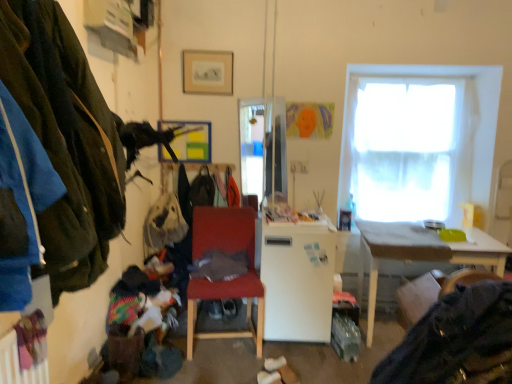
This screenshot has height=384, width=512. Describe the element at coordinates (432, 291) in the screenshot. I see `velvet-like brown swivel chair at lower right` at that location.

I want to click on transparent plastic door at center, so click(x=263, y=147).

In order to click on white sheer curtain at upper right in this screenshot , I will do `click(417, 141)`.

Is matte gold picture frame at upper center, the 1th picture frame from the top, facing towards matte red chair at center?

No, matte gold picture frame at upper center, the 1th picture frame from the top, is not aimed at matte red chair at center.

How many degrees apart are the facing directions of matte gold picture frame at upper center, which ranks as the first picture frame in front-to-back order, and matte red chair at center?

11.1 degrees separate the facing orientations of matte gold picture frame at upper center, which ranks as the first picture frame in front-to-back order, and matte red chair at center.

Is there a large distance between matte gold picture frame at upper center, which ranks as the first picture frame in front-to-back order, and matte red chair at center?

matte gold picture frame at upper center, which ranks as the first picture frame in front-to-back order, is positioned a significant distance from matte red chair at center.

Considering the sizes of velvet green jacket at left, arranged as the 1th clothing when viewed from the top, and matte red chair at center in the image, is velvet green jacket at left, arranged as the 1th clothing when viewed from the top, wider or thinner than matte red chair at center?

In the image, velvet green jacket at left, arranged as the 1th clothing when viewed from the top, appears to be more narrow than matte red chair at center.

In the scene shown: Can we say velvet green jacket at left, arranged as the 1th clothing when viewed from the top, lies outside matte red chair at center?

Yes, velvet green jacket at left, arranged as the 1th clothing when viewed from the top, is located beyond the bounds of matte red chair at center.

In the scene shown: Is velvet green jacket at left, arranged as the 1th clothing when viewed from the top, looking in the opposite direction of matte red chair at center?

No, velvet green jacket at left, arranged as the 1th clothing when viewed from the top, is not facing away from matte red chair at center.

From a real-world perspective, is velvet green jacket at left, arranged as the 1th clothing when viewed from the top, physically located above or below matte red chair at center?

In terms of real-world spatial position, velvet green jacket at left, arranged as the 1th clothing when viewed from the top, is above matte red chair at center.

Does metallic silver picture frame at upper center, the first picture frame positioned from the bottom, appear on the right side of matte gold picture frame at upper center, which ranks as the first picture frame in front-to-back order?

No, metallic silver picture frame at upper center, the first picture frame positioned from the bottom, is not to the right of matte gold picture frame at upper center, which ranks as the first picture frame in front-to-back order.

Could matte gold picture frame at upper center, which ranks as the first picture frame in front-to-back order, be considered to be inside metallic silver picture frame at upper center, the first picture frame positioned from the bottom?

That's incorrect, matte gold picture frame at upper center, which ranks as the first picture frame in front-to-back order, is not inside metallic silver picture frame at upper center, the first picture frame positioned from the bottom.

Which of these two, metallic silver picture frame at upper center, acting as the first picture frame starting from the back, or matte gold picture frame at upper center, the 2th picture frame positioned from the back, is smaller?

With smaller size is matte gold picture frame at upper center, the 2th picture frame positioned from the back.

From a real-world perspective, is metallic silver picture frame at upper center, positioned as the second picture frame in front-to-back order, over matte gold picture frame at upper center, the 1th picture frame from the top?

No, from a real-world perspective, metallic silver picture frame at upper center, positioned as the second picture frame in front-to-back order, is not on top of matte gold picture frame at upper center, the 1th picture frame from the top.

From the image's perspective, does velvet-like brown swivel chair at lower right appear lower than white matte refrigerator at center?

Incorrect, from the image's perspective, velvet-like brown swivel chair at lower right is higher than white matte refrigerator at center.

From a real-world perspective, between velvet-like brown swivel chair at lower right and white matte refrigerator at center, who is vertically higher?

velvet-like brown swivel chair at lower right.

Which of these two, velvet-like brown swivel chair at lower right or white matte refrigerator at center, is wider?

With larger width is white matte refrigerator at center.

Considering the relative sizes of white sheer curtain at upper right and white matte refrigerator at center in the image provided, is white sheer curtain at upper right bigger than white matte refrigerator at center?

No, white sheer curtain at upper right is not bigger than white matte refrigerator at center.

Relative to white matte refrigerator at center, is white sheer curtain at upper right in front or behind?

white sheer curtain at upper right is positioned farther from the viewer than white matte refrigerator at center.

From the image's perspective, is white sheer curtain at upper right located above or below white matte refrigerator at center?

white sheer curtain at upper right is above white matte refrigerator at center.

At what (x,y) coordinates should I click in order to perform the action: click on window below the velvet green jacket at left, the second clothing when ordered from right to left (from a real-world perspective). Please return your answer as a coordinate pair (x, y). Image resolution: width=512 pixels, height=384 pixels. Looking at the image, I should click on (417, 141).

From a real-world perspective, relative to white sheer curtain at upper right, is velvet green jacket at left, the second clothing when ordered from right to left, vertically above or below?

velvet green jacket at left, the second clothing when ordered from right to left, is above white sheer curtain at upper right.

Which is in front, point (72, 61) or point (351, 191)?

The point (72, 61) is in front.

Can you confirm if white matte refrigerator at center is wider than white sheer curtain at upper right?

Yes, white matte refrigerator at center is wider than white sheer curtain at upper right.

Considering the sizes of objects white matte refrigerator at center and white sheer curtain at upper right in the image provided, who is taller, white matte refrigerator at center or white sheer curtain at upper right?

white sheer curtain at upper right is taller.

Is white matte refrigerator at center looking in the opposite direction of white sheer curtain at upper right?

No, white matte refrigerator at center is not facing away from white sheer curtain at upper right.

Can you confirm if white matte refrigerator at center is smaller than white sheer curtain at upper right?

Incorrect, white matte refrigerator at center is not smaller in size than white sheer curtain at upper right.

Find the location of a particular element. This screenshot has width=512, height=384. the 1st picture frame to the left when counting from the matte red chair at center is located at coordinates (207, 72).

Locate an element on the screen. the 2nd clothing positioned above the matte red chair at center (from a real-world perspective) is located at coordinates (66, 139).

Looking at the image, which one is located closer to velvet green jacket at left, the second clothing when ordered from right to left, velvet-like brown swivel chair at lower right or transparent plastic door at center?

The object closer to velvet green jacket at left, the second clothing when ordered from right to left, is velvet-like brown swivel chair at lower right.

When comparing their distances from velvet green jacket at left, the second clothing positioned from the bottom, does white sheer curtain at upper right or dark gray fabric at lower right, arranged as the second clothing when viewed from the left, seem closer?

dark gray fabric at lower right, arranged as the second clothing when viewed from the left, is positioned closer to the anchor velvet green jacket at left, the second clothing positioned from the bottom.

Looking at the image, which one is located further to white sheer curtain at upper right, dark gray fabric at lower right, which ranks as the first clothing in bottom-to-top order, or matte red chair at center?

The object further to white sheer curtain at upper right is dark gray fabric at lower right, which ranks as the first clothing in bottom-to-top order.

Which object lies further to the anchor point matte white desk at right, transparent plastic door at center or velvet-like brown swivel chair at lower right?

velvet-like brown swivel chair at lower right lies further to matte white desk at right than the other object.

Estimate the real-world distances between objects in this image. Which object is closer to matte gold picture frame at upper center, placed as the second picture frame when sorted from bottom to top, matte white desk at right or metallic silver picture frame at upper center, positioned as the second picture frame in front-to-back order?

Among the two, metallic silver picture frame at upper center, positioned as the second picture frame in front-to-back order, is located nearer to matte gold picture frame at upper center, placed as the second picture frame when sorted from bottom to top.

When comparing their distances from white sheer curtain at upper right, does matte white desk at right or transparent plastic door at center seem further?

Among the two, transparent plastic door at center is located further to white sheer curtain at upper right.

Based on their spatial positions, is dark gray fabric at lower right, the 1th clothing positioned from the right, or velvet-like brown swivel chair at lower right closer to white matte refrigerator at center?

The object closer to white matte refrigerator at center is velvet-like brown swivel chair at lower right.

From the image, which object appears to be nearer to transparent plastic door at center, metallic silver picture frame at upper center, acting as the first picture frame starting from the back, or white matte refrigerator at center?

metallic silver picture frame at upper center, acting as the first picture frame starting from the back.

Image resolution: width=512 pixels, height=384 pixels. Find the location of `chair positioned between velvet green jacket at left, the second clothing when ordered from right to left, and white sheer curtain at upper right from near to far`. chair positioned between velvet green jacket at left, the second clothing when ordered from right to left, and white sheer curtain at upper right from near to far is located at coordinates (225, 281).

This screenshot has width=512, height=384. What are the coordinates of `window screen located between metallic silver picture frame at upper center, acting as the first picture frame starting from the back, and white sheer curtain at upper right in the left-right direction` in the screenshot? It's located at (263, 147).

At what (x,y) coordinates should I click in order to perform the action: click on picture frame located between velvet green jacket at left, arranged as the 1th clothing when viewed from the top, and transparent plastic door at center in the depth direction. Please return your answer as a coordinate pair (x, y). This screenshot has width=512, height=384. Looking at the image, I should click on (207, 72).

Find the location of a particular element. The width and height of the screenshot is (512, 384). swivel chair located between velvet green jacket at left, the second clothing positioned from the bottom, and white sheer curtain at upper right in the depth direction is located at coordinates (432, 291).